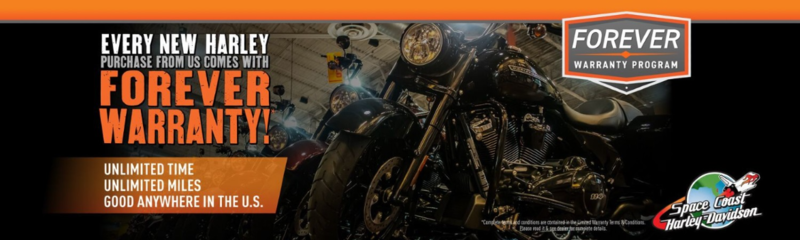
Find the location of a particular element. The image size is (800, 240). fan is located at coordinates (366, 30).